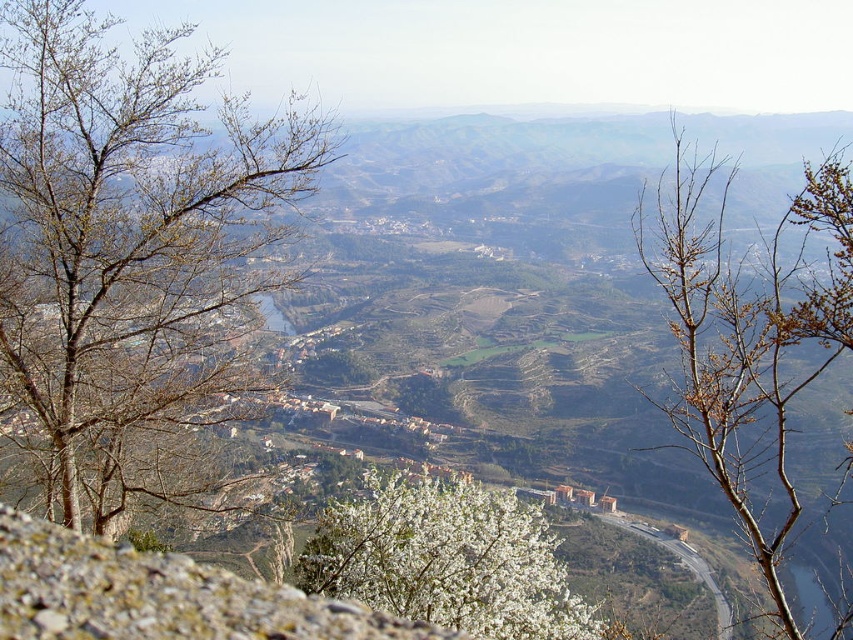
Question: In this image, where is bare branches at upper center located relative to white blossoming bush at center?

Choices:
 (A) below
 (B) above

Answer: (B)

Question: Which is nearer to the bare branches at upper center?

Choices:
 (A) white blossoming bush at center
 (B) bare branches at left

Answer: (A)

Question: Is bare branches at left further to the viewer compared to white blossoming bush at center?

Choices:
 (A) no
 (B) yes

Answer: (B)

Question: Is bare branches at upper center thinner than white blossoming bush at center?

Choices:
 (A) yes
 (B) no

Answer: (B)

Question: Which point is farther to the camera?

Choices:
 (A) (746, 401)
 (B) (36, 378)

Answer: (B)

Question: Which object appears closest to the camera in this image?

Choices:
 (A) white blossoming bush at center
 (B) bare branches at upper center

Answer: (B)